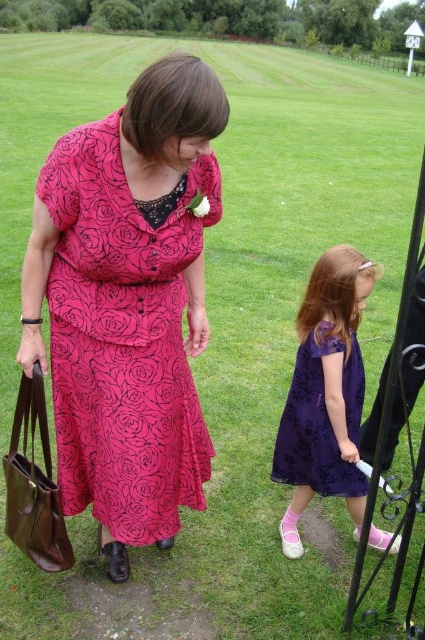
You are a photographer at a formal event. You need to position the purple satin dress at lower right and the purple lace dress at lower right in your shot. Based on their widths, which dress should you place closer to the center to ensure both fit in the frame?

The purple satin dress at lower right might be wider than the purple lace dress at lower right, so placing the wider purple satin dress at lower right closer to the center would help both fit within the frame.

You are standing at the point with coordinates point (323, 456) and want to walk to the point with coordinates point (172, 516). Which direction should you move relative to your current position?

You should move forward because point (172, 516) is in front of point (323, 456).